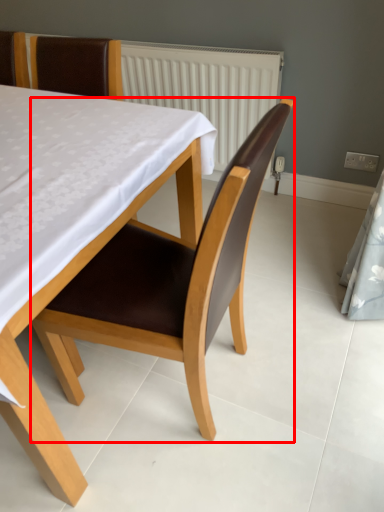
Question: From the image's perspective, what is the correct spatial relationship of chair (annotated by the red box) in relation to chair?

Choices:
 (A) below
 (B) above

Answer: (A)